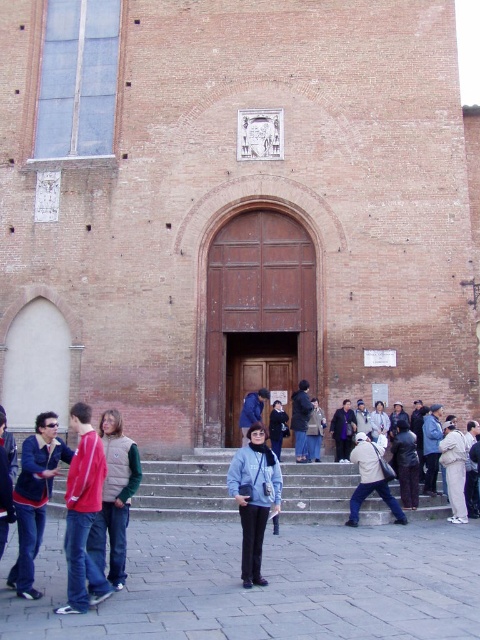
Question: Which of the following is the closest to the observer?

Choices:
 (A) blue fabric jacket at center
 (B) dark gray jacket at center

Answer: (A)

Question: Does stone steps at center appear on the right side of dark blue jacket at lower left?

Choices:
 (A) no
 (B) yes

Answer: (B)

Question: Is red jacket at lower left positioned before white cotton shirt at center?

Choices:
 (A) no
 (B) yes

Answer: (B)

Question: Which point appears farthest from the camera in this image?

Choices:
 (A) (113, 465)
 (B) (75, 534)
 (C) (33, 452)

Answer: (A)

Question: Is red jacket at lower left bigger than white cotton shirt at center?

Choices:
 (A) no
 (B) yes

Answer: (B)

Question: Among these points, which one is nearest to the camera?

Choices:
 (A) (275, 422)
 (B) (342, 440)
 (C) (115, 440)

Answer: (C)